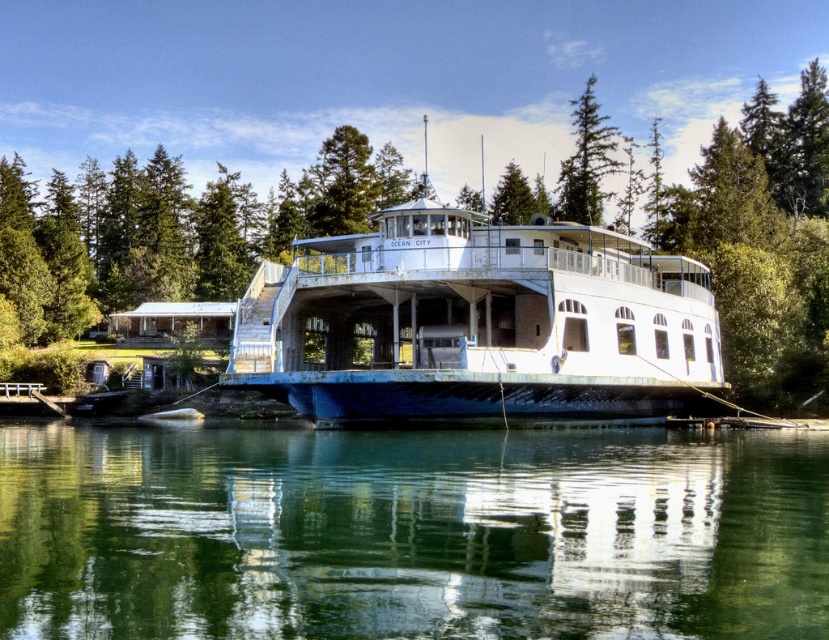
Consider the image. You are a passenger on the ferry and want to take a photo of the green textured pine tree at upper center from the white matte boat at center. Is the boat positioned below the tree to allow for a clear view?

Yes, the white matte boat at center is located below the green textured pine tree at upper center, so the boat is positioned in a way that allows for a clear view of the tree.

You are standing on the ferry and looking towards the shore. Which object is closer to you, the clear water at lower center or the green textured pine tree at upper center?

The clear water at lower center is closer to you because it is in front of the green textured pine tree at upper center.

You are a photographer planning to capture the white matte boat at center and the green textured pine tree at upper center in a single frame. Based on their sizes, which object will occupy more space horizontally in the photo?

The white matte boat at center will occupy more space horizontally in the photo because its width surpasses that of the green textured pine tree at upper center.